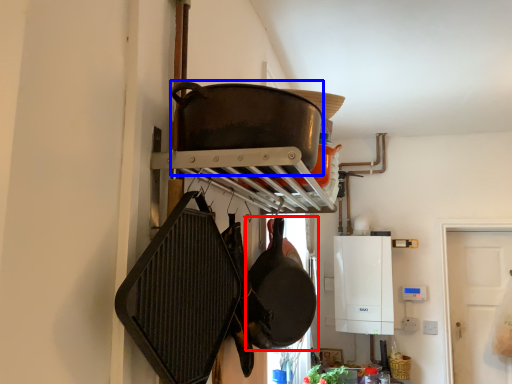
Question: Which point is further to the camera, frying pan (highlighted by a red box) or wok (highlighted by a blue box)?

Choices:
 (A) frying pan
 (B) wok

Answer: (A)